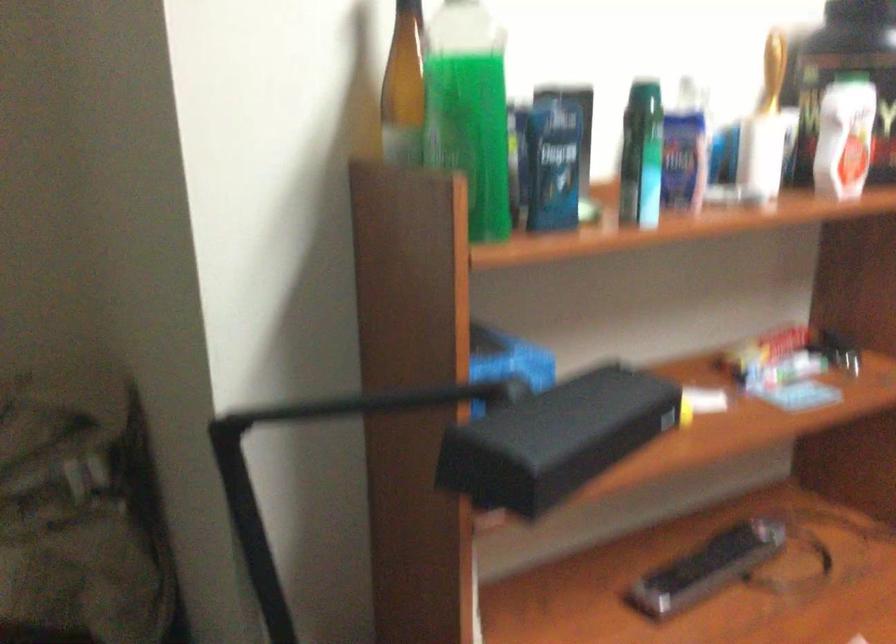
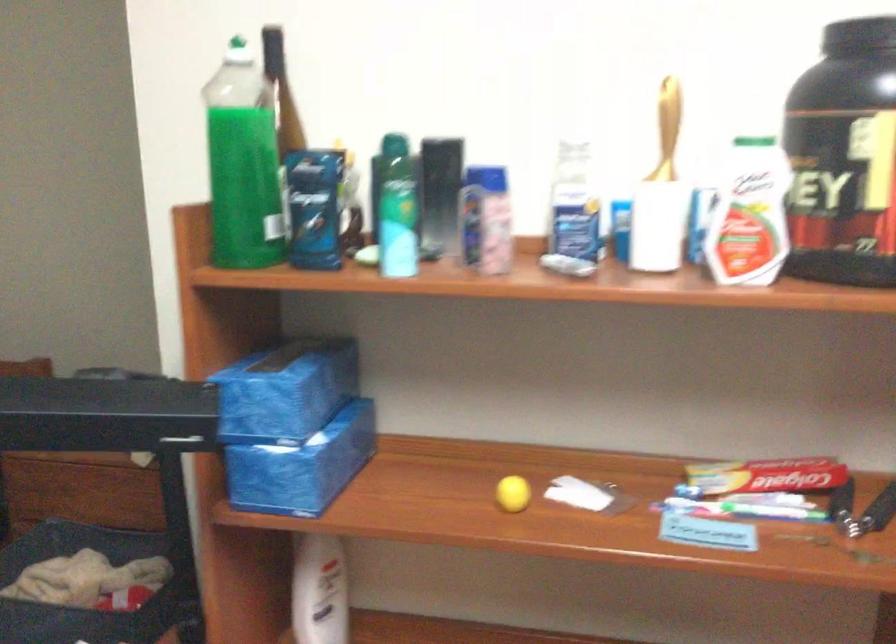
Where in the second image is the point corresponding to point 682,409 from the first image?

(513, 494)